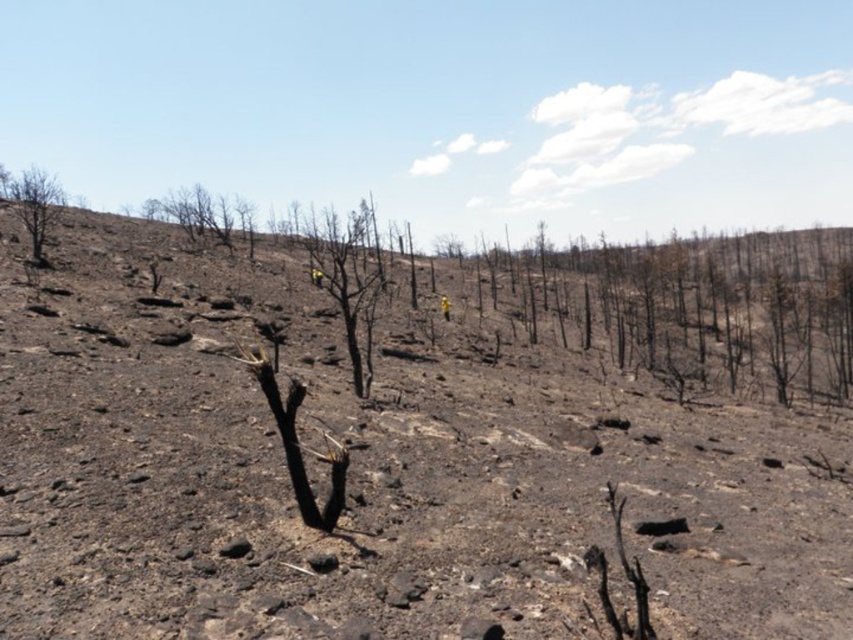
Question: Can you confirm if charcoal-barked tree at upper left is thinner than bare wood tree at upper left?

Choices:
 (A) yes
 (B) no

Answer: (B)

Question: Is charcoal ash hillside at center further to camera compared to bare wood tree at upper left?

Choices:
 (A) yes
 (B) no

Answer: (B)

Question: Is charcoal bark tree at center wider than bare wood tree at upper left?

Choices:
 (A) yes
 (B) no

Answer: (B)

Question: Which is nearer to the charcoal ash hillside at center?

Choices:
 (A) charcoal bark tree at center
 (B) bare wood tree at upper left
 (C) charcoal-barked tree at upper left

Answer: (A)

Question: Among these points, which one is nearest to the camera?

Choices:
 (A) (193, 220)
 (B) (310, 280)
 (C) (21, 221)
 (D) (415, 372)

Answer: (D)

Question: Which object is positioned farthest from the bare wood tree at upper left?

Choices:
 (A) charcoal ash hillside at center
 (B) charcoal bark tree at center

Answer: (A)